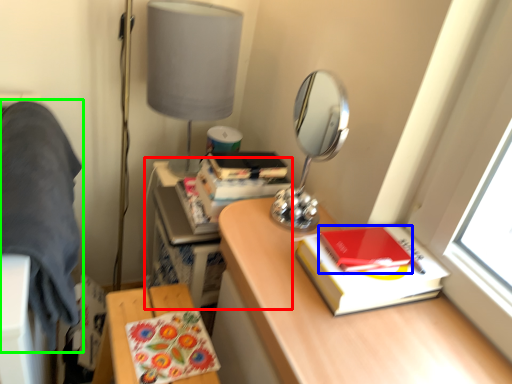
Question: Considering the real-world distances, which object is farthest from computer desk (highlighted by a red box)? notebook (highlighted by a blue box) or bedding (highlighted by a green box)?

Choices:
 (A) notebook
 (B) bedding

Answer: (A)